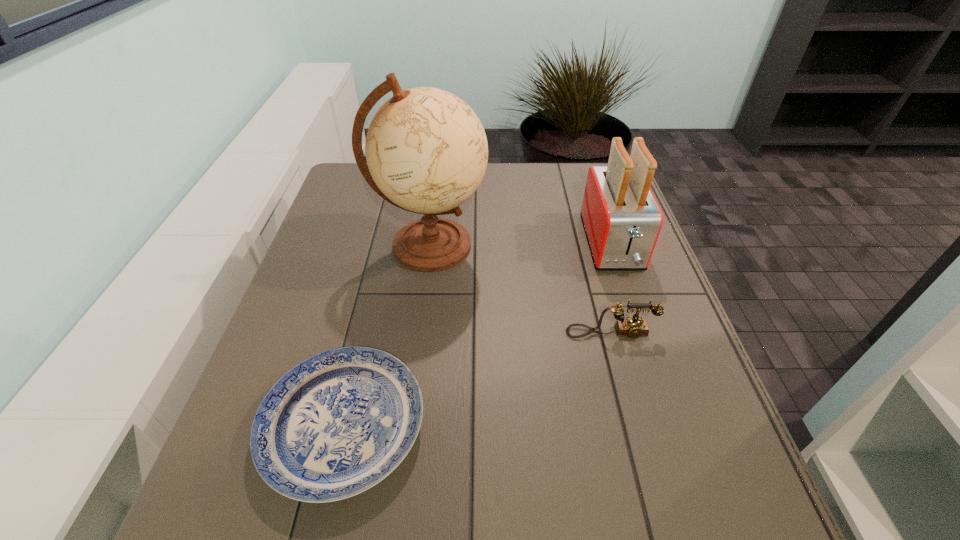
The image size is (960, 540). Identify the location of object at the near edge. (338, 423).

Find the location of a particular element. The image size is (960, 540). object that is at the left edge is located at coordinates (338, 423).

Where is `toaster located at the right edge`? toaster located at the right edge is located at coordinates (622, 219).

Where is `telephone that is positioned at the right edge`? The image size is (960, 540). telephone that is positioned at the right edge is located at coordinates (633, 327).

Identify the location of object located at the near left corner. (338, 423).

Where is `free space at the far edge`? The image size is (960, 540). free space at the far edge is located at coordinates (529, 186).

At what (x,y) coordinates should I click in order to perform the action: click on vacant space at the near edge of the desktop. Please return your answer as a coordinate pair (x, y). This screenshot has height=540, width=960. Looking at the image, I should click on (606, 503).

Where is `vacant region at the left edge`? vacant region at the left edge is located at coordinates (263, 379).

In the image, there is a desktop. At what (x,y) coordinates should I click in order to perform the action: click on vacant space at the near left corner. Please return your answer as a coordinate pair (x, y). This screenshot has height=540, width=960. Looking at the image, I should click on (267, 493).

Image resolution: width=960 pixels, height=540 pixels. Identify the location of unoccupied position between the third tallest object and the globe. (520, 289).